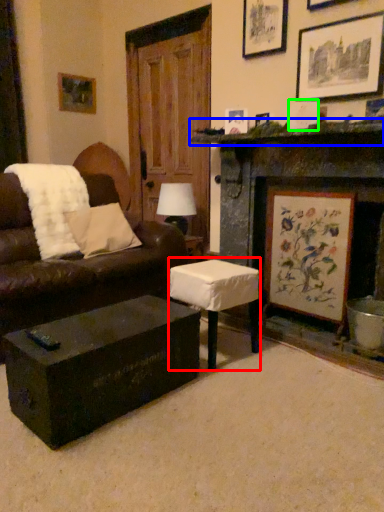
Question: Estimate the real-world distances between objects in this image. Which object is farther from table (highlighted by a red box), mantle (highlighted by a blue box) or picture frame (highlighted by a green box)?

Choices:
 (A) mantle
 (B) picture frame

Answer: (B)